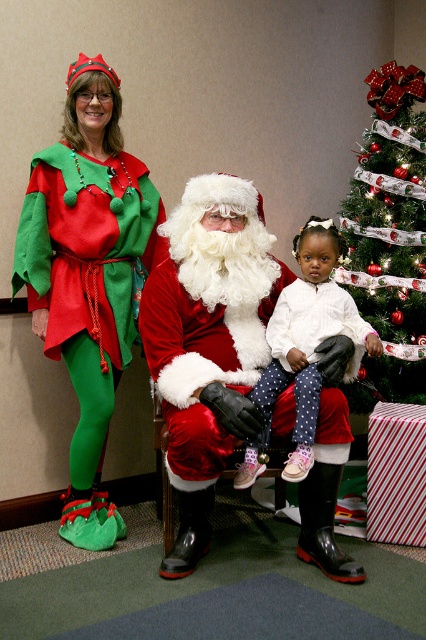
Which of these two, satin/velvet santa at center or white polka dot pants at center, stands taller?

With more height is satin/velvet santa at center.

Can you confirm if satin/velvet santa at center is taller than white polka dot pants at center?

Indeed, satin/velvet santa at center has a greater height compared to white polka dot pants at center.

Identify the location of satin/velvet santa at center. The image size is (426, 640). (209, 340).

The width and height of the screenshot is (426, 640). What do you see at coordinates (89, 275) in the screenshot?
I see `matte green fabric elf costume at left` at bounding box center [89, 275].

Does matte green fabric elf costume at left appear on the right side of white polka dot pants at center?

No, matte green fabric elf costume at left is not to the right of white polka dot pants at center.

Is point (95, 301) more distant than point (316, 275)?

Yes, it is.

The image size is (426, 640). In order to click on matte green fabric elf costume at left in this screenshot , I will do `click(89, 275)`.

Is point (189, 525) less distant than point (83, 200)?

Yes.

Between satin/velvet santa at center and matte green fabric elf costume at left, which one is positioned lower?

satin/velvet santa at center is lower down.

Who is more distant from viewer, (196, 369) or (155, 189)?

Positioned behind is point (155, 189).

Where is `satin/velvet santa at center`? This screenshot has height=640, width=426. satin/velvet santa at center is located at coordinates (209, 340).